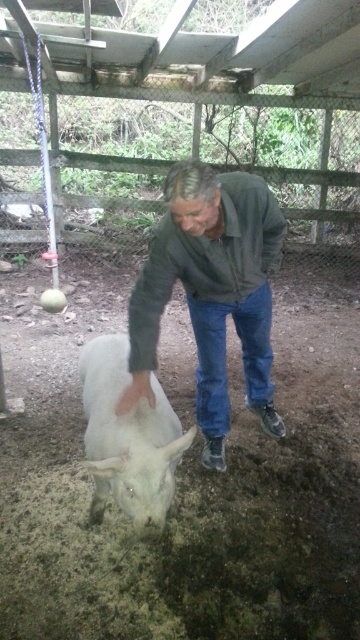
Can you confirm if green matte shirt at center is shorter than white woolly goat at lower left?

In fact, green matte shirt at center may be taller than white woolly goat at lower left.

Is the position of green matte shirt at center more distant than that of white woolly goat at lower left?

Yes.

Is point (249, 276) positioned before point (122, 493)?

No, it is behind (122, 493).

The height and width of the screenshot is (640, 360). In order to click on green matte shirt at center in this screenshot , I will do `click(210, 292)`.